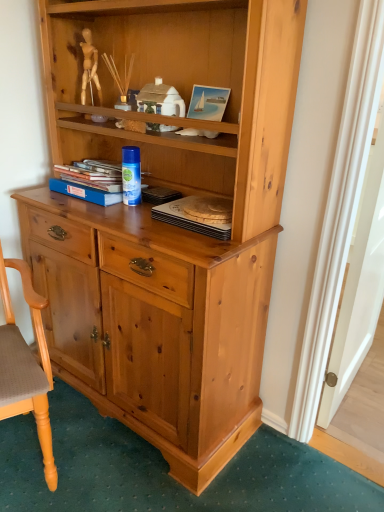
Question: Is blue hardcover book at center, which is the 1th book in left-to-right order, spatially inside wooden round tray at center, the 1th book viewed from the right, or outside of it?

Choices:
 (A) inside
 (B) outside

Answer: (B)

Question: Looking at the image, does blue hardcover book at center, the 2th book positioned from the right, seem bigger or smaller compared to wooden round tray at center, the second book positioned from the left?

Choices:
 (A) big
 (B) small

Answer: (A)

Question: Considering the real-world distances, which object is farthest from the blue hardcover book at center, the 2th book positioned from the right?

Choices:
 (A) wooden round tray at center, the second book positioned from the left
 (B) wooden polished chair at lower left

Answer: (B)

Question: Based on their relative distances, which object is nearer to the wooden polished chair at lower left?

Choices:
 (A) blue hardcover book at center, the 2th book positioned from the right
 (B) wooden round tray at center, the 1th book viewed from the right

Answer: (A)